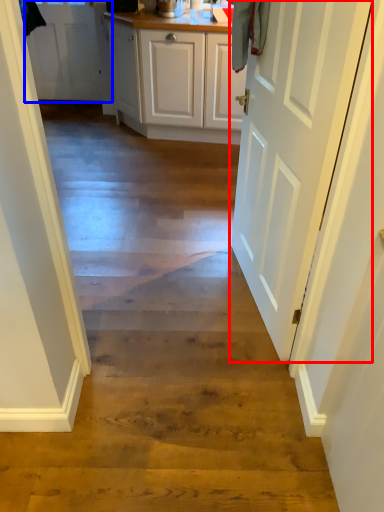
Question: Which point is closer to the camera, door (highlighted by a red box) or door (highlighted by a blue box)?

Choices:
 (A) door
 (B) door

Answer: (A)